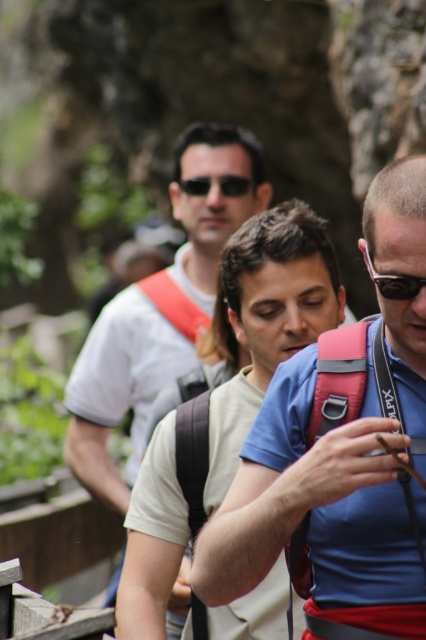
Question: Does matte blue shirt at center appear on the right side of white matte t-shirt at center?

Choices:
 (A) yes
 (B) no

Answer: (A)

Question: Can you confirm if white matte t-shirt at center is positioned above matte black sunglasses at center?

Choices:
 (A) no
 (B) yes

Answer: (A)

Question: Which of these objects is positioned closest to the black plastic sunglasses at center right?

Choices:
 (A) matte blue shirt at center
 (B) white matte t-shirt at center

Answer: (A)

Question: Which of the following is the farthest from the observer?

Choices:
 (A) matte blue shirt at center
 (B) white matte t-shirt at center

Answer: (B)

Question: In this image, where is matte blue shirt at center located relative to matte black sunglasses at center?

Choices:
 (A) left
 (B) right

Answer: (B)

Question: Estimate the real-world distances between objects in this image. Which object is closer to the black plastic sunglasses at center right?

Choices:
 (A) white matte t-shirt at center
 (B) matte black sunglasses at center
 (C) matte blue shirt at center

Answer: (C)